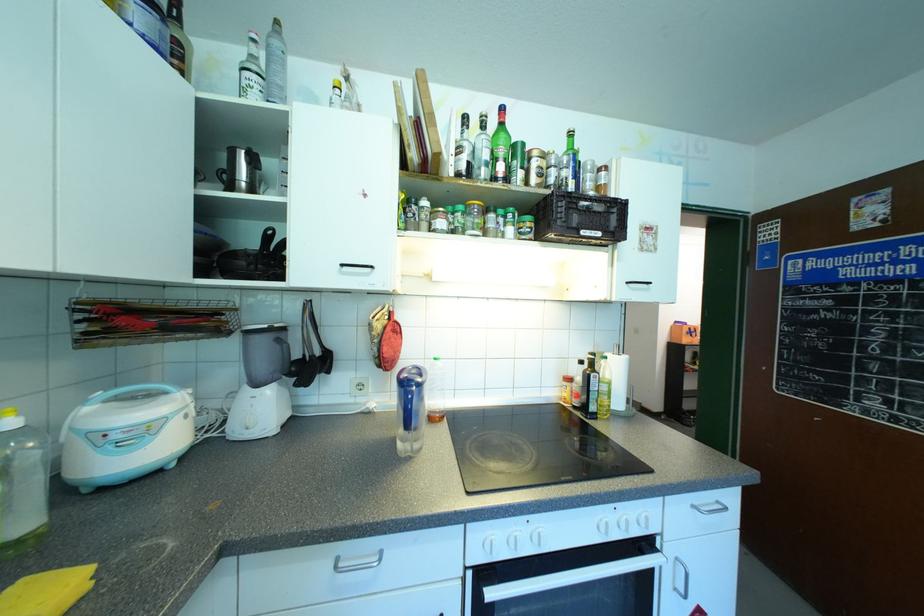
What do you see at coordinates (358, 562) in the screenshot?
I see `the silver cabinet handle` at bounding box center [358, 562].